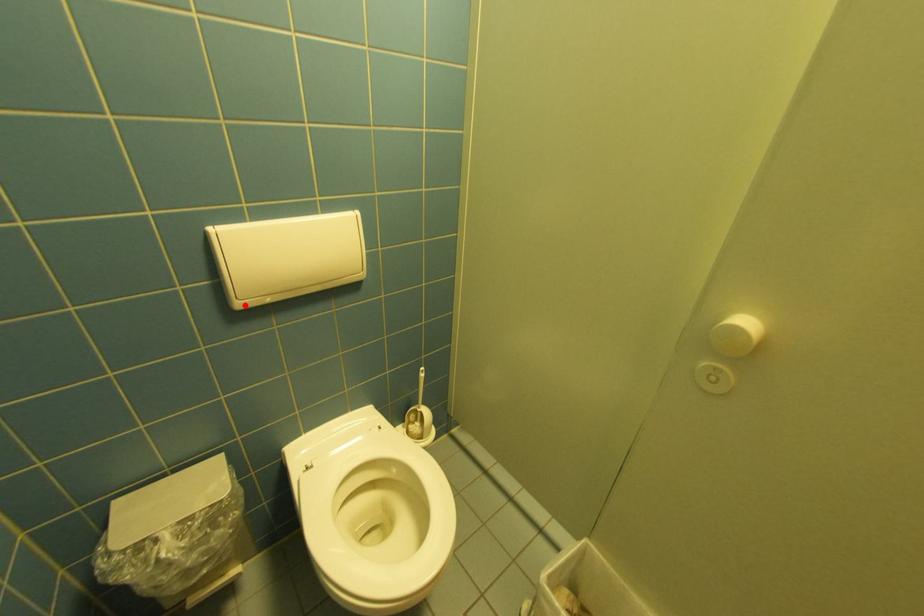
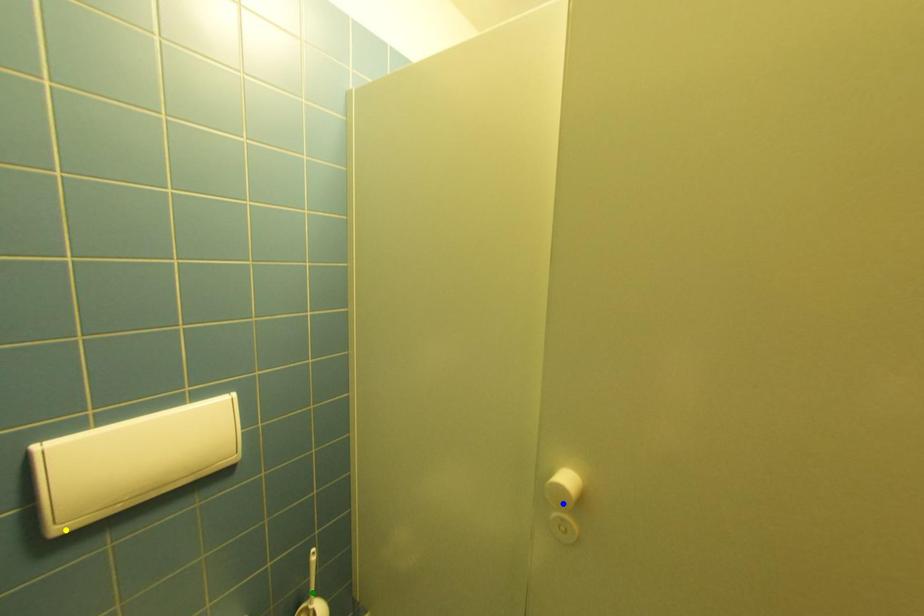
Question: I am providing you with two images of the same scene from different viewpoints. A red point is marked on the first image. You are given multiple points on the second image. Which spot in image 2 lines up with the point in image 1?

Choices:
 (A) blue point
 (B) green point
 (C) yellow point

Answer: (C)